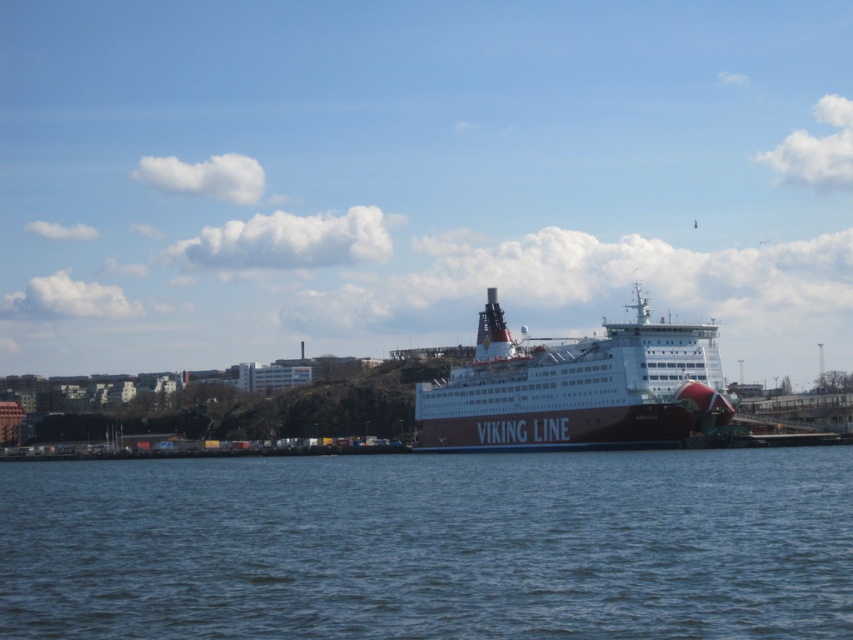
Does blue water at center have a larger size compared to dark blue metallic ferry at center?

Actually, blue water at center might be smaller than dark blue metallic ferry at center.

Between blue water at center and dark blue metallic ferry at center, which one appears on the left side from the viewer's perspective?

blue water at center

Who is more distant from viewer, (x=697, y=502) or (x=560, y=356)?

Positioned behind is point (x=560, y=356).

Image resolution: width=853 pixels, height=640 pixels. Find the location of `blue water at center`. blue water at center is located at coordinates (431, 545).